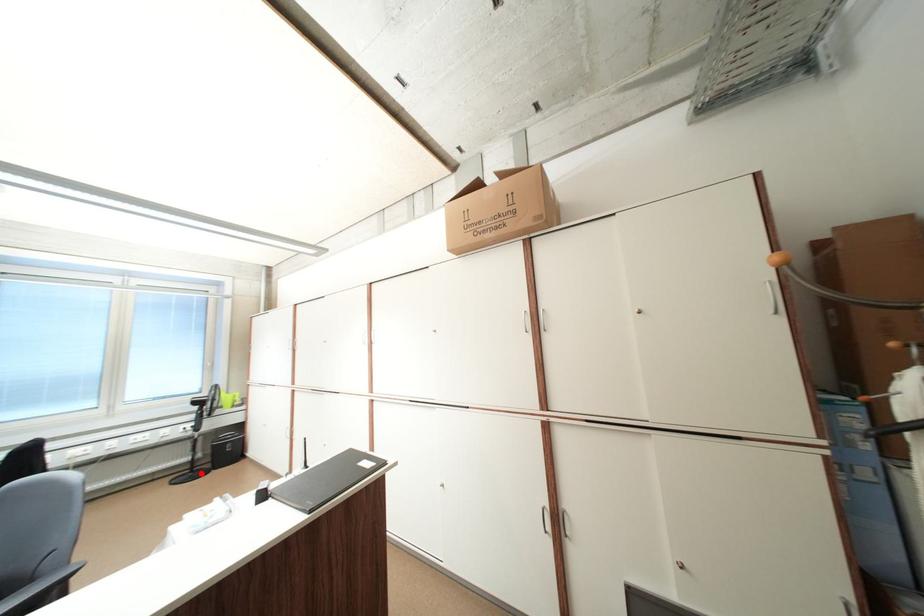
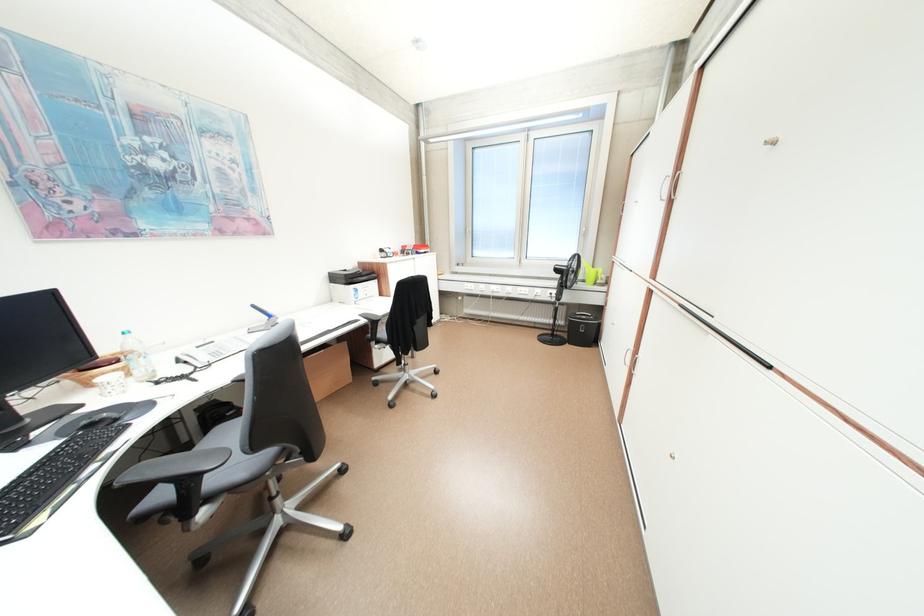
Question: I am providing you with two images of the same scene from different viewpoints. In image1, a red point is highlighted. Considering the same 3D point in image2, which of the following is correct?

Choices:
 (A) It is closer
 (B) It is farther

Answer: (B)